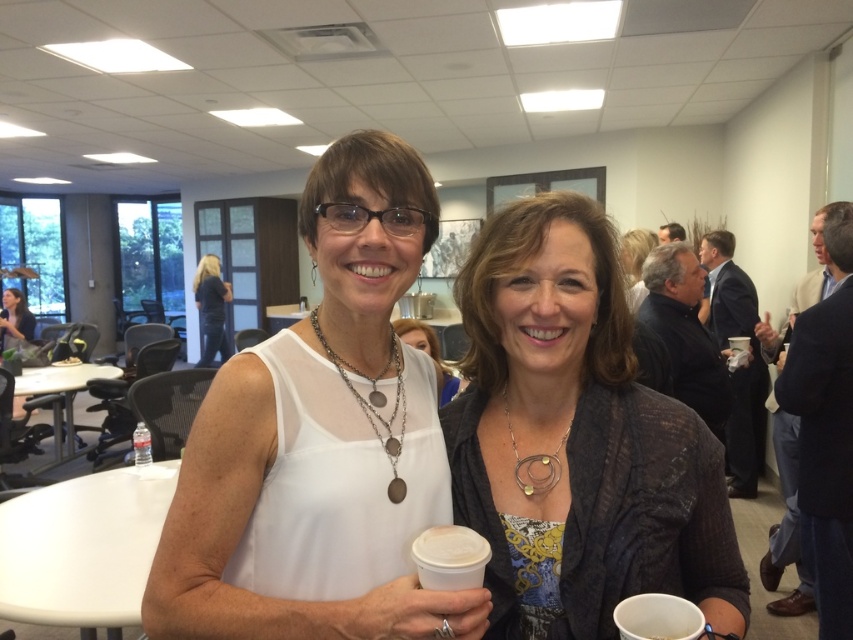
You are a photographer standing at a distance of 30 inches from the white matte cup at center. You want to take a closeup shot of it. Do you need to move closer or farther away?

The white matte cup at center is 29.35 inches away from the camera. Since you are currently 30 inches away, you need to move slightly closer to achieve the desired closeup shot.

You are a photographer adjusting your camera settings to focus on the white matte tank top at center and the white matte cup at center. Which object should you focus on first to ensure proper depth of field?

You should focus on the white matte tank top at center first because it is closer to the viewer than the white matte cup at center, ensuring the depth of field captures both objects clearly.